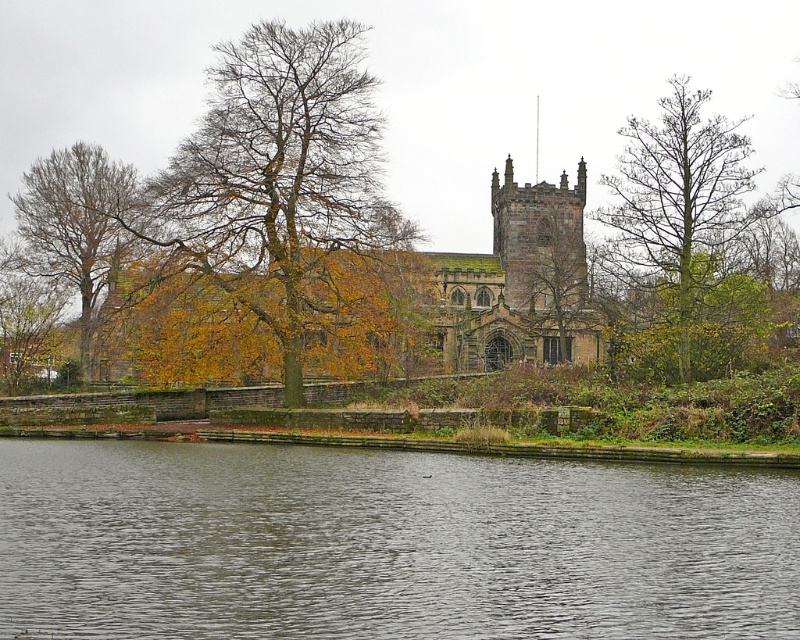
You are standing at the edge of the water in the scene and want to look at both point (238, 288) and point (34, 182). Which point will appear closer to your eyes?

Point (238, 288) is closer to the viewer than point (34, 182), so it will appear closer to your eyes.

Based on the photo, you are standing on the dock and want to place a small boat between the brown leafy tree at center and the brown leafy tree at left. Can you fit the boat there?

The brown leafy tree at center is positioned under brown leafy tree at left, so there is no space between them for the boat to fit.